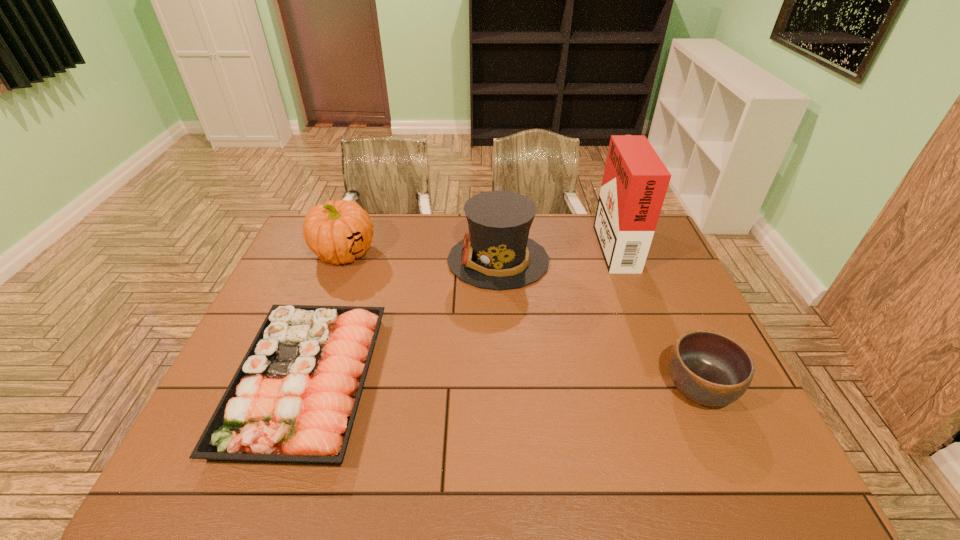
Where is `blank region between the platter and the tallest object`? This screenshot has height=540, width=960. blank region between the platter and the tallest object is located at coordinates (460, 312).

Locate an element on the screen. The image size is (960, 540). free point between the tallest object and the dress hat is located at coordinates (556, 252).

Find the location of a particular element. The image size is (960, 540). free space that is in between the dress hat and the second shortest object is located at coordinates click(599, 324).

Locate an element on the screen. This screenshot has width=960, height=540. unoccupied position between the pumpkin and the bowl is located at coordinates (521, 320).

Where is `free spot between the third object from right to left and the platter`? free spot between the third object from right to left and the platter is located at coordinates (402, 321).

At what (x,y) coordinates should I click in order to perform the action: click on free area in between the dress hat and the shortest object. Please return your answer as a coordinate pair (x, y). This screenshot has height=540, width=960. Looking at the image, I should click on (402, 321).

The height and width of the screenshot is (540, 960). Identify the location of vacant point located between the third object from left to right and the tallest object. (556, 252).

Find the location of `vacant area that lies between the shortest object and the third object from left to right`. vacant area that lies between the shortest object and the third object from left to right is located at coordinates (402, 321).

Find the location of `the fourth closest object to the third object from right to left`. the fourth closest object to the third object from right to left is located at coordinates click(x=709, y=368).

You are a GUI agent. You are given a task and a screenshot of the screen. Output one action in this format:
    pyautogui.click(x=<x>, y=<y>)
    Task: Click on the third closest object relative to the dress hat
    Image resolution: width=960 pixels, height=540 pixels.
    Given the screenshot: What is the action you would take?
    tap(337, 232)